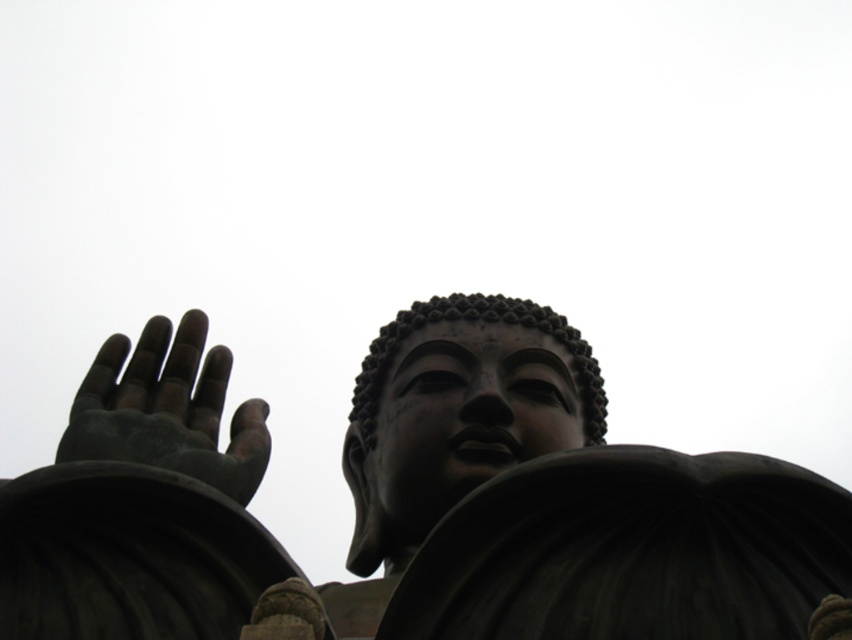
Consider the image. Is black polished statue at center to the left of matte bronze hand at lower left from the viewer's perspective?

Incorrect, black polished statue at center is not on the left side of matte bronze hand at lower left.

Is point (507, 579) behind point (101, 449)?

No, (507, 579) is closer to viewer.

The width and height of the screenshot is (852, 640). What do you see at coordinates (413, 506) in the screenshot?
I see `black polished statue at center` at bounding box center [413, 506].

I want to click on black polished statue at center, so coord(413,506).

Can you confirm if black polished statue at center is shorter than matte black statue at center?

Indeed, black polished statue at center has a lesser height compared to matte black statue at center.

Which is more to the right, black polished statue at center or matte black statue at center?

matte black statue at center

At what (x,y) coordinates should I click in order to perform the action: click on black polished statue at center. Please return your answer as a coordinate pair (x, y). The width and height of the screenshot is (852, 640). Looking at the image, I should click on (413, 506).

Does matte black statue at center have a larger size compared to matte bronze hand at lower left?

Yes, matte black statue at center is bigger than matte bronze hand at lower left.

In the scene shown: Who is shorter, matte black statue at center or matte bronze hand at lower left?

With less height is matte bronze hand at lower left.

You are a GUI agent. You are given a task and a screenshot of the screen. Output one action in this format:
    pyautogui.click(x=<x>, y=<y>)
    Task: Click on the matte black statue at center
    
    Given the screenshot: What is the action you would take?
    pyautogui.click(x=458, y=412)